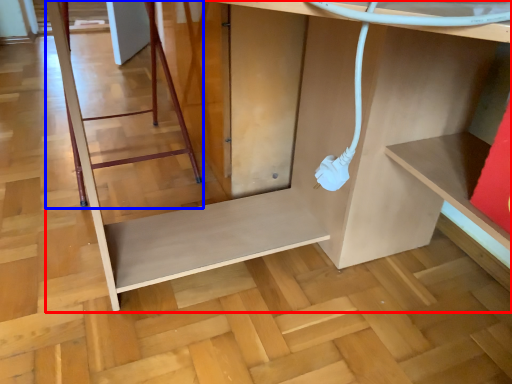
Question: Which object is further to the camera taking this photo, furniture (highlighted by a red box) or ladder (highlighted by a blue box)?

Choices:
 (A) furniture
 (B) ladder

Answer: (B)